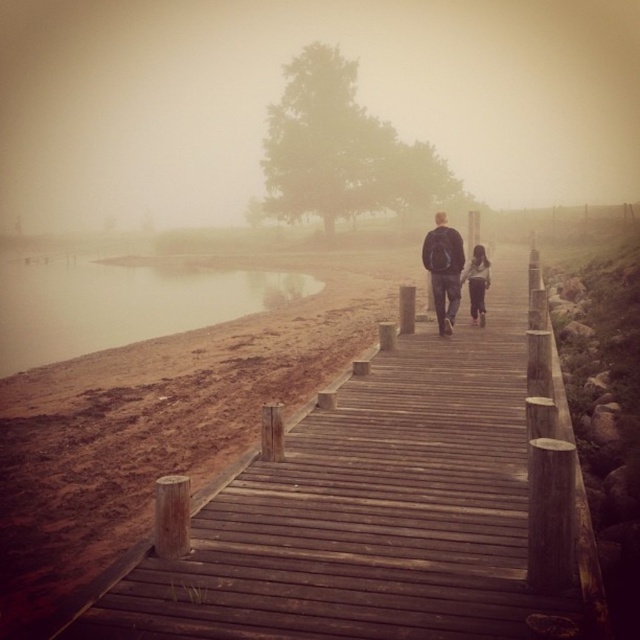
You are standing at the origin point of the coordinate system in the image. You want to place a small decorative rock exactly at the location of the brown dirt at lower left. What are the coordinates where you should place the rock?

The coordinates for the brown dirt at lower left are at point [122,301], so you should place the rock at those coordinates.

You are a hiker standing on the wooden boardwalk and want to reach both the point at coordinates point (157, 272) and point (440, 278). Which point should you go to first if you want to reach the one closer to you?

You should go to point (157, 272) first because it is closer to you than point (440, 278).